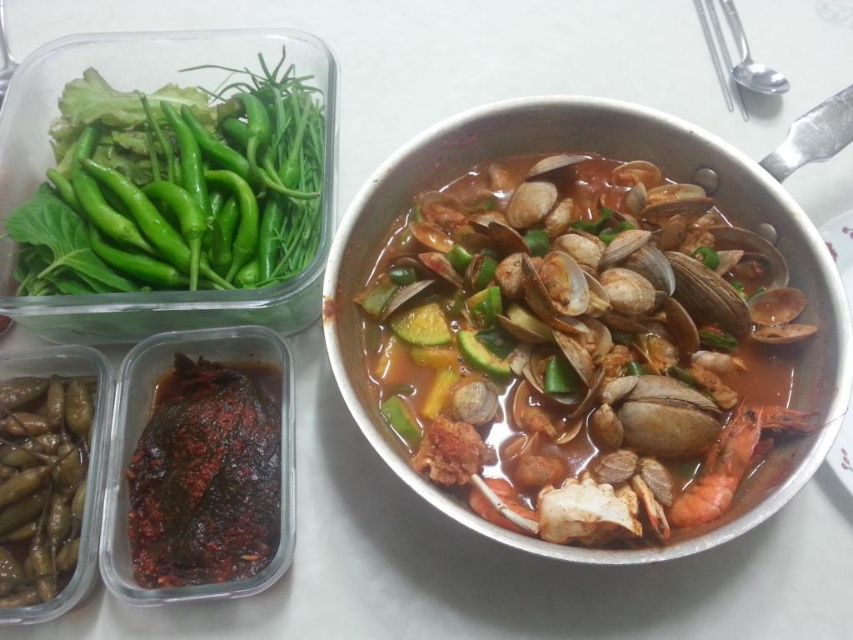
You are a food delivery person who needs to place a 10 inch long thermometer in the space between the green glossy chili peppers at upper left and the dark brown glossy fish at lower left. Will it fit?

The distance between the green glossy chili peppers at upper left and the dark brown glossy fish at lower left is 9.90 inches. Since the thermometer is 10 inches long, it will not fit in the space between them.